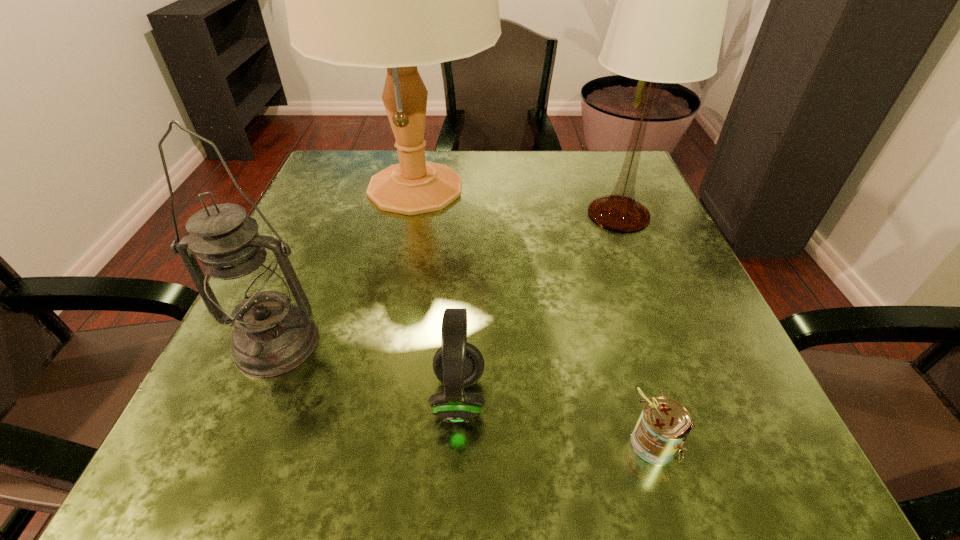
In order to click on object located in the near right corner section of the desktop in this screenshot , I will do `click(664, 424)`.

Locate an element on the screen. The width and height of the screenshot is (960, 540). free space at the far edge is located at coordinates (536, 181).

In order to click on free space at the near edge in this screenshot , I will do `click(550, 458)`.

This screenshot has width=960, height=540. Identify the location of vacant area at the left edge. (306, 214).

The width and height of the screenshot is (960, 540). In order to click on free space at the right edge of the desktop in this screenshot , I will do `click(663, 288)`.

The width and height of the screenshot is (960, 540). I want to click on free region at the far left corner, so click(317, 183).

Identify the location of vacant space at the far right corner. This screenshot has height=540, width=960. (612, 165).

Identify the location of free point between the shorter table lamp and the second shortest object. [x=539, y=306].

At what (x,y) coordinates should I click in order to perform the action: click on free space between the tallest object and the headset. Please return your answer as a coordinate pair (x, y). The width and height of the screenshot is (960, 540). Looking at the image, I should click on (437, 293).

Locate an element on the screen. unoccupied area between the fourth shortest object and the fourth tallest object is located at coordinates (539, 306).